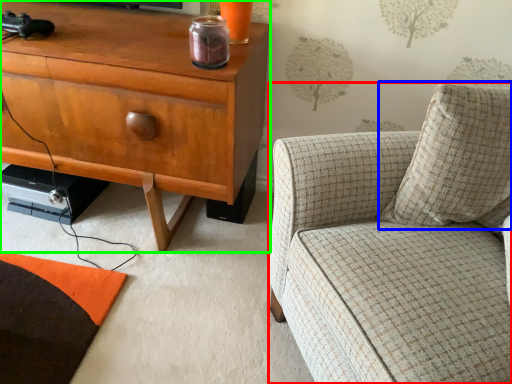
Question: Based on their relative distances, which object is nearer to chair (highlighted by a red box)? Choose from pillow (highlighted by a blue box) and cabinetry (highlighted by a green box).

Choices:
 (A) pillow
 (B) cabinetry

Answer: (A)